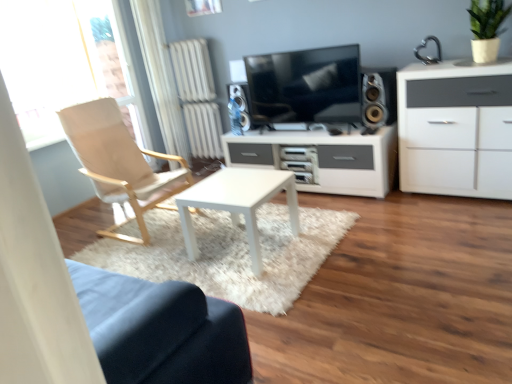
Question: Is light beige fabric chair at left located within silver metallic speaker at right, the second speaker positioned from the back?

Choices:
 (A) yes
 (B) no

Answer: (B)

Question: From a real-world perspective, is silver metallic speaker at right, the second speaker positioned from the back, positioned over light beige fabric chair at left based on gravity?

Choices:
 (A) no
 (B) yes

Answer: (B)

Question: Is silver metallic speaker at right, the second speaker positioned from the back, shorter than light beige fabric chair at left?

Choices:
 (A) no
 (B) yes

Answer: (B)

Question: Is silver metallic speaker at right, the second speaker positioned from the back, bigger than light beige fabric chair at left?

Choices:
 (A) no
 (B) yes

Answer: (A)

Question: Is silver metallic speaker at right, which ranks as the 2th speaker in left-to-right order, at the left side of light beige fabric chair at left?

Choices:
 (A) yes
 (B) no

Answer: (B)

Question: From the image's perspective, is transparent glass window at upper left located above or below white matte cabinet at right?

Choices:
 (A) above
 (B) below

Answer: (A)

Question: In terms of width, does transparent glass window at upper left look wider or thinner when compared to white matte cabinet at right?

Choices:
 (A) thin
 (B) wide

Answer: (A)

Question: Is point (33, 54) positioned closer to the camera than point (400, 188)?

Choices:
 (A) closer
 (B) farther

Answer: (B)

Question: In the image, is transparent glass window at upper left positioned in front of or behind white matte cabinet at right?

Choices:
 (A) front
 (B) behind

Answer: (B)

Question: Is white fabric curtain at left to the left or to the right of white matte cabinet at right in the image?

Choices:
 (A) left
 (B) right

Answer: (A)

Question: Considering the positions of white fabric curtain at left and white matte cabinet at right in the image, is white fabric curtain at left bigger or smaller than white matte cabinet at right?

Choices:
 (A) big
 (B) small

Answer: (B)

Question: In the image, is white fabric curtain at left positioned in front of or behind white matte cabinet at right?

Choices:
 (A) behind
 (B) front

Answer: (A)

Question: Is white fabric curtain at left inside or outside of white matte cabinet at right?

Choices:
 (A) outside
 (B) inside

Answer: (A)

Question: Considering their positions, is matte black tv at center located in front of or behind white matte cabinet at right?

Choices:
 (A) behind
 (B) front

Answer: (A)

Question: From a real-world perspective, is matte black tv at center physically located above or below white matte cabinet at right?

Choices:
 (A) above
 (B) below

Answer: (A)